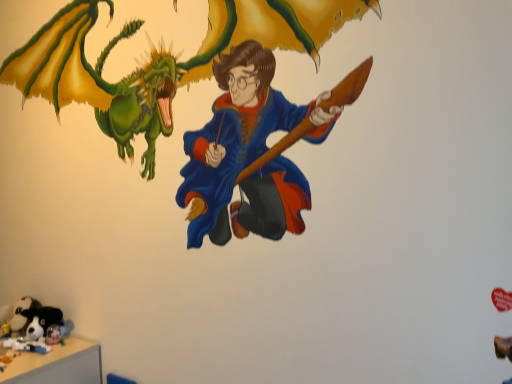
At what (x,y) coordinates should I click in order to perform the action: click on free spot to the right of soft plush toy at bottom left. Please return your answer as a coordinate pair (x, y). The height and width of the screenshot is (384, 512). Looking at the image, I should click on (71, 343).